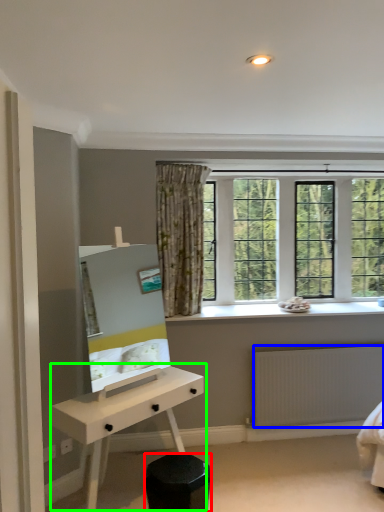
Question: Estimate the real-world distances between objects in this image. Which object is farther from stool (highlighted by a red box), radiator (highlighted by a blue box) or desk (highlighted by a green box)?

Choices:
 (A) radiator
 (B) desk

Answer: (A)